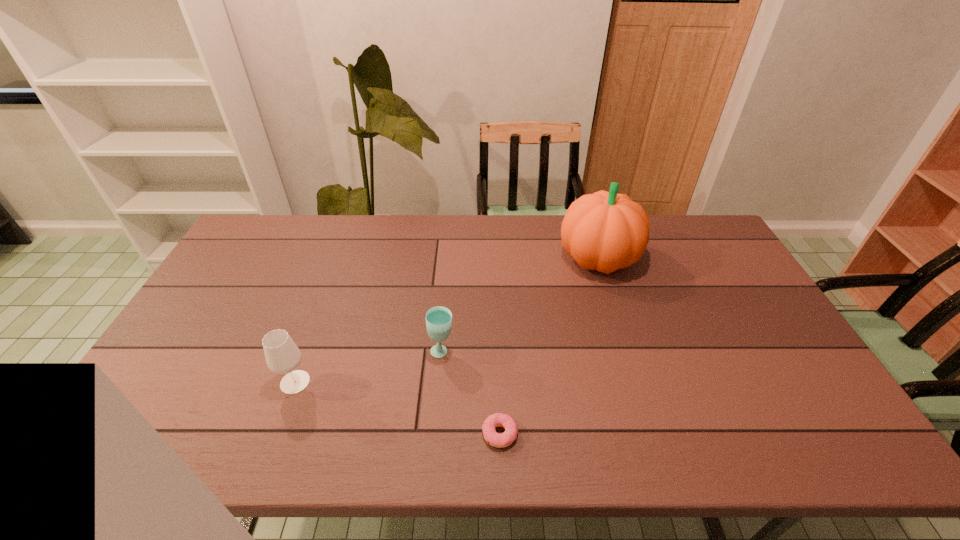
I want to click on free space between the nearest object and the tallest object, so click(549, 346).

Where is `vacant space that is in between the third tallest object and the nearest object`? The image size is (960, 540). vacant space that is in between the third tallest object and the nearest object is located at coordinates (470, 393).

At what (x,y) coordinates should I click in order to perform the action: click on vacant point located between the second farthest object and the taller glass. Please return your answer as a coordinate pair (x, y). The width and height of the screenshot is (960, 540). Looking at the image, I should click on (369, 367).

Find the location of a particular element. The height and width of the screenshot is (540, 960). unoccupied position between the nearest object and the third tallest object is located at coordinates (470, 393).

Find the location of a particular element. The height and width of the screenshot is (540, 960). blank region between the tallest object and the right glass is located at coordinates (520, 305).

You are a GUI agent. You are given a task and a screenshot of the screen. Output one action in this format:
    pyautogui.click(x=<x>, y=<y>)
    Task: Click on the free space that is in between the third farthest object and the third object from left to right
    
    Given the screenshot: What is the action you would take?
    pyautogui.click(x=397, y=408)

Where is `vacant space that is in between the pumpkin and the second object from right to left`? The height and width of the screenshot is (540, 960). vacant space that is in between the pumpkin and the second object from right to left is located at coordinates (549, 346).

The image size is (960, 540). Identify the location of free spot between the left glass and the right glass. (369, 367).

At what (x,y) coordinates should I click in order to perform the action: click on object that is the third closest to the left glass. Please return your answer as a coordinate pair (x, y). This screenshot has height=540, width=960. Looking at the image, I should click on (604, 231).

Identify which object is the third nearest to the third tallest object. Please provide its 2D coordinates. Your answer should be formatted as a tuple, i.e. [(x, y)], where the tuple contains the x and y coordinates of a point satisfying the conditions above.

[(604, 231)]